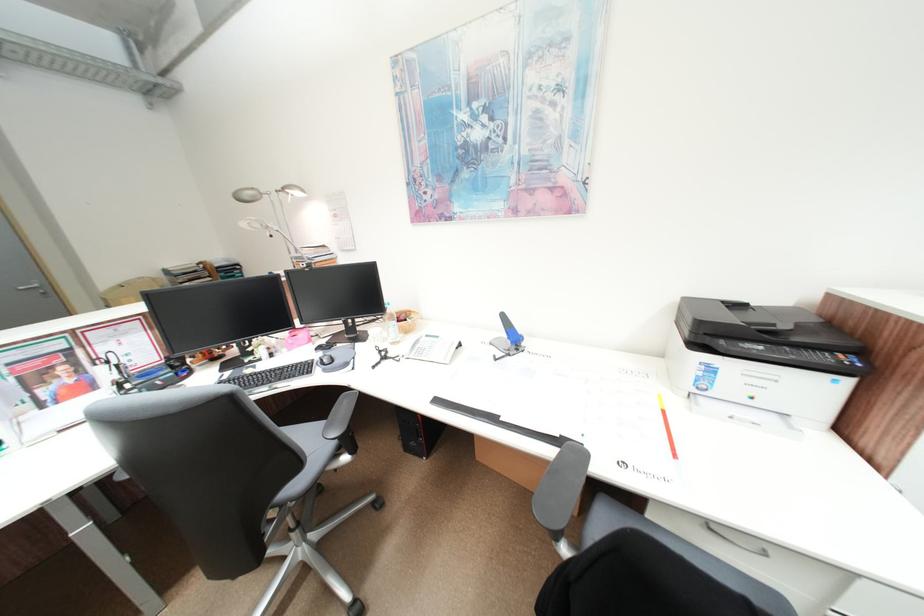
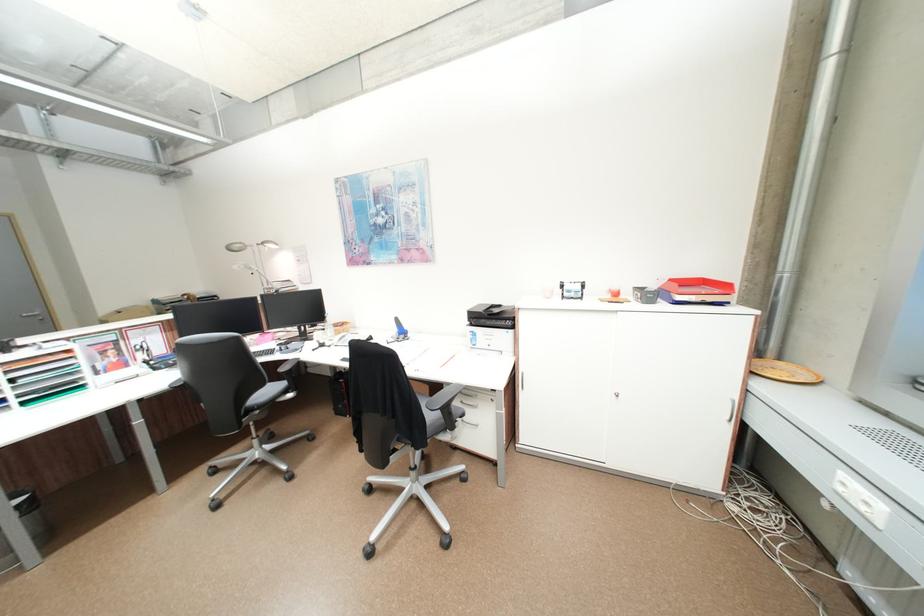
Locate, in the second image, the point that corresponds to (256,199) in the first image.

(245, 249)